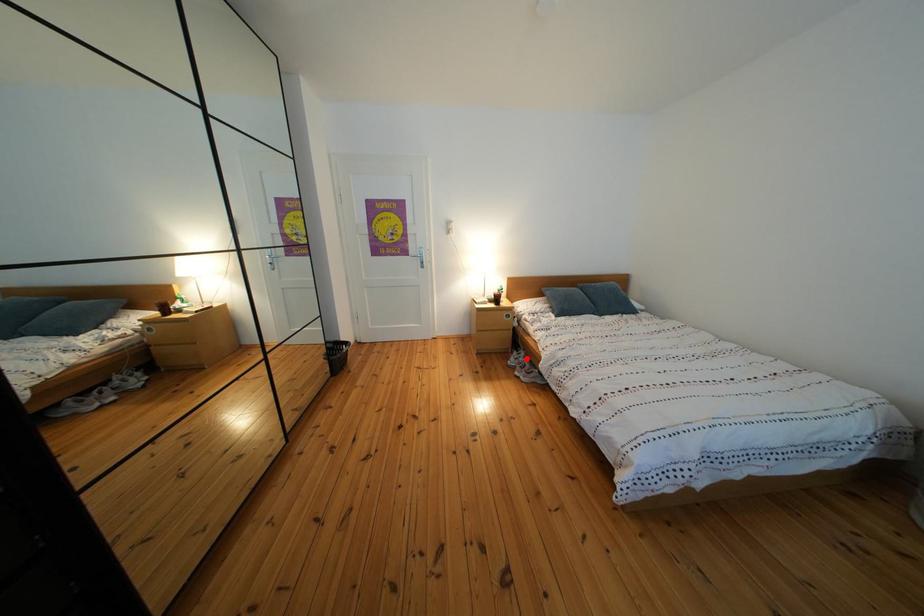
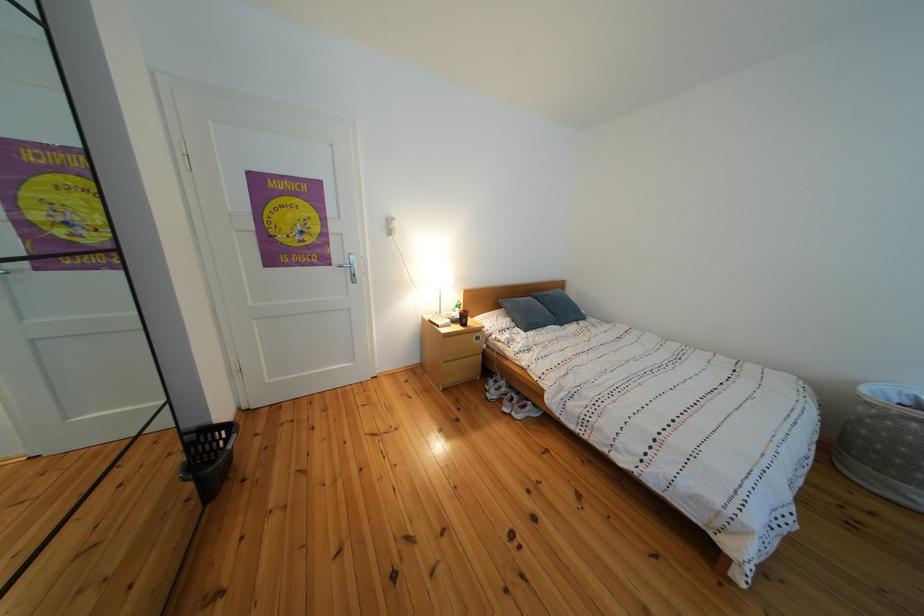
Question: I am providing you with two images of the same scene from different viewpoints. In image1, a red point is highlighted. Considering the same 3D point in image2, which of the following is correct?

Choices:
 (A) It is closer
 (B) It is farther

Answer: (A)